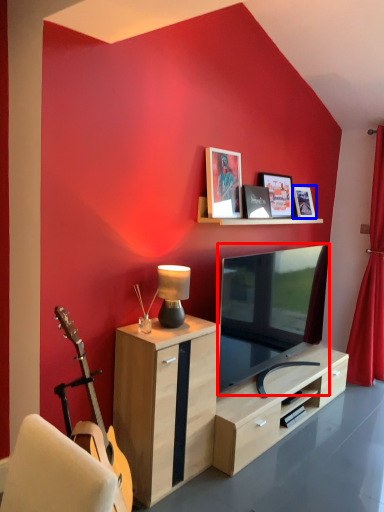
Question: Which point is closer to the camera, television (highlighted by a red box) or picture frame (highlighted by a blue box)?

Choices:
 (A) television
 (B) picture frame

Answer: (A)